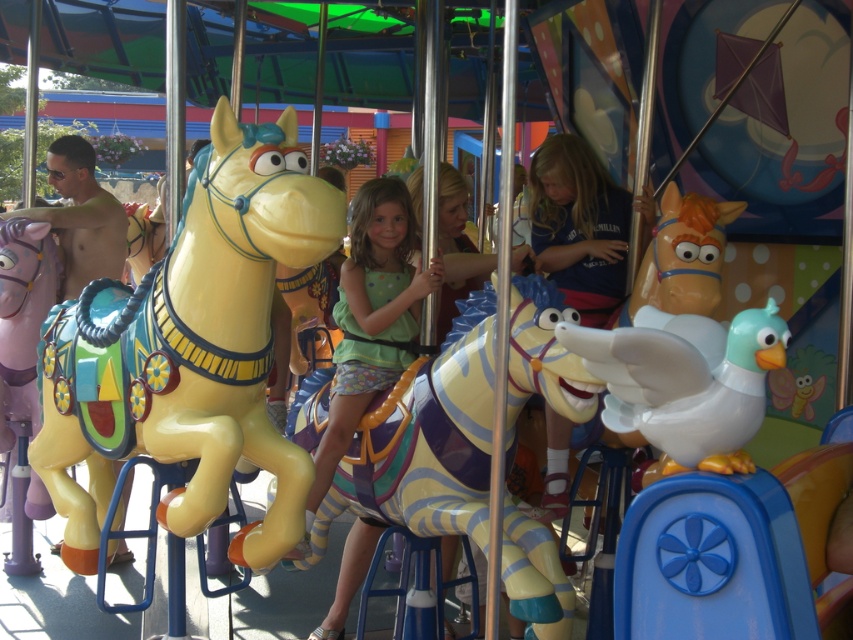
You are a parent trying to decide which toy to buy for your child between the glossy yellow horse at left and the matte green dress at center. Based on their sizes, which one would be more suitable for a child to play with comfortably?

The glossy yellow horse at left is bigger than the matte green dress at center, so it would be more suitable for a child to play with comfortably due to its larger size.

You are a parent trying to find your child who is sitting on the glossy yellow horse at left. Your child wants to move to the seat on the matte green dress at center. Which direction should they move to get there?

The glossy yellow horse at left is to the left of the matte green dress at center, so your child should move to the right to reach the matte green dress at center.

You are standing in front of the carousel at the amusement park and see the matte green dress at center. If you want to reach the dress quickly, should you walk towards the carousel or away from it?

You should walk towards the carousel because the matte green dress at center is 4.67 meters away from you, so moving closer will reduce the distance.